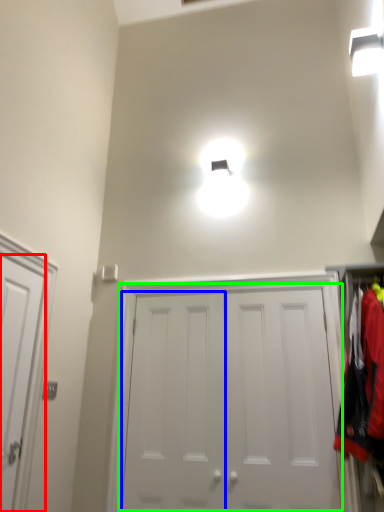
Question: Estimate the real-world distances between objects in this image. Which object is farther from door (highlighted by a red box), door (highlighted by a blue box) or door (highlighted by a green box)?

Choices:
 (A) door
 (B) door

Answer: (B)